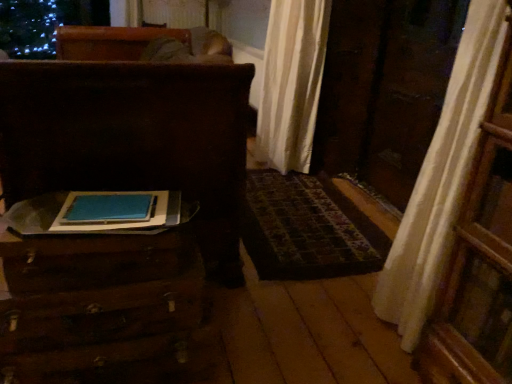
The image size is (512, 384). What do you see at coordinates (118, 235) in the screenshot? I see `wooden trunk at left, which is the second furniture in bottom-to-top order` at bounding box center [118, 235].

Where is `wooden trunk at left, which is the second furniture in bottom-to-top order`? The image size is (512, 384). wooden trunk at left, which is the second furniture in bottom-to-top order is located at coordinates (118, 235).

Where is `wooden suitcase at lower left, acting as the 1th furniture starting from the bottom`? Image resolution: width=512 pixels, height=384 pixels. wooden suitcase at lower left, acting as the 1th furniture starting from the bottom is located at coordinates (95, 301).

Describe the element at coordinates (95, 301) in the screenshot. The image size is (512, 384). I see `wooden suitcase at lower left, acting as the 1th furniture starting from the bottom` at that location.

At what (x,y) coordinates should I click in order to perform the action: click on wooden trunk at left, acting as the 1th furniture starting from the top. Please return your answer as a coordinate pair (x, y). The image size is (512, 384). Looking at the image, I should click on (118, 235).

Considering the positions of objects wooden suitcase at lower left, acting as the 1th furniture starting from the bottom, and wooden trunk at left, acting as the 1th furniture starting from the top, in the image provided, who is more to the right, wooden suitcase at lower left, acting as the 1th furniture starting from the bottom, or wooden trunk at left, acting as the 1th furniture starting from the top,?

From the viewer's perspective, wooden suitcase at lower left, acting as the 1th furniture starting from the bottom, appears more on the right side.

Which is in front, wooden suitcase at lower left, acting as the 1th furniture starting from the bottom, or wooden trunk at left, which is the second furniture in bottom-to-top order?

wooden suitcase at lower left, acting as the 1th furniture starting from the bottom, is more forward.

Between point (66, 353) and point (103, 251), which one is positioned in front?

Positioned in front is point (103, 251).

From the image's perspective, is wooden suitcase at lower left, which is the second furniture from top to bottom, on wooden trunk at left, acting as the 1th furniture starting from the top?

No, from the image's perspective, wooden suitcase at lower left, which is the second furniture from top to bottom, is not on top of wooden trunk at left, acting as the 1th furniture starting from the top.

From a real-world perspective, is wooden suitcase at lower left, acting as the 1th furniture starting from the bottom, positioned above or below wooden trunk at left, acting as the 1th furniture starting from the top?

Clearly, from a real-world perspective, wooden suitcase at lower left, acting as the 1th furniture starting from the bottom, is below wooden trunk at left, acting as the 1th furniture starting from the top.

Is wooden suitcase at lower left, which is the second furniture from top to bottom, wider than wooden trunk at left, which is the second furniture in bottom-to-top order?

No, wooden suitcase at lower left, which is the second furniture from top to bottom, is not wider than wooden trunk at left, which is the second furniture in bottom-to-top order.

In the scene shown: In terms of height, does wooden suitcase at lower left, acting as the 1th furniture starting from the bottom, look taller or shorter compared to wooden trunk at left, acting as the 1th furniture starting from the top?

Considering their sizes, wooden suitcase at lower left, acting as the 1th furniture starting from the bottom, has less height than wooden trunk at left, acting as the 1th furniture starting from the top.

Can you confirm if wooden suitcase at lower left, acting as the 1th furniture starting from the bottom, is smaller than wooden trunk at left, acting as the 1th furniture starting from the top?

Yes.

Is wooden suitcase at lower left, acting as the 1th furniture starting from the bottom, inside or outside of wooden trunk at left, which is the second furniture in bottom-to-top order?

wooden suitcase at lower left, acting as the 1th furniture starting from the bottom, is located beyond the bounds of wooden trunk at left, which is the second furniture in bottom-to-top order.

Can you see wooden suitcase at lower left, acting as the 1th furniture starting from the bottom, touching wooden trunk at left, acting as the 1th furniture starting from the top?

wooden suitcase at lower left, acting as the 1th furniture starting from the bottom, and wooden trunk at left, acting as the 1th furniture starting from the top, are clearly separated.

From the picture: Is wooden suitcase at lower left, which is the second furniture from top to bottom, positioned with its back to wooden trunk at left, acting as the 1th furniture starting from the top?

No.

How different are the orientations of wooden suitcase at lower left, which is the second furniture from top to bottom, and wooden trunk at left, acting as the 1th furniture starting from the top, in degrees?

5.11 degrees.

How far apart are wooden suitcase at lower left, which is the second furniture from top to bottom, and wooden trunk at left, acting as the 1th furniture starting from the top?

wooden suitcase at lower left, which is the second furniture from top to bottom, and wooden trunk at left, acting as the 1th furniture starting from the top, are 15.22 inches apart from each other.

I want to click on furniture that appears below the wooden trunk at left, which is the second furniture in bottom-to-top order (from a real-world perspective), so click(x=95, y=301).

Is wooden trunk at left, acting as the 1th furniture starting from the top, at the left side of wooden suitcase at lower left, which is the second furniture from top to bottom?

Indeed, wooden trunk at left, acting as the 1th furniture starting from the top, is positioned on the left side of wooden suitcase at lower left, which is the second furniture from top to bottom.

In the image, is wooden trunk at left, which is the second furniture in bottom-to-top order, positioned in front of or behind wooden suitcase at lower left, which is the second furniture from top to bottom?

In the image, wooden trunk at left, which is the second furniture in bottom-to-top order, appears behind wooden suitcase at lower left, which is the second furniture from top to bottom.

Considering the points (8, 80) and (61, 292), which point is in front, point (8, 80) or point (61, 292)?

The point (61, 292) is closer.

From the image's perspective, would you say wooden trunk at left, which is the second furniture in bottom-to-top order, is positioned over wooden suitcase at lower left, which is the second furniture from top to bottom?

Correct, wooden trunk at left, which is the second furniture in bottom-to-top order, appears higher than wooden suitcase at lower left, which is the second furniture from top to bottom, in the image.

From a real-world perspective, is wooden trunk at left, which is the second furniture in bottom-to-top order, located beneath wooden suitcase at lower left, acting as the 1th furniture starting from the bottom?

No, from a real-world perspective, wooden trunk at left, which is the second furniture in bottom-to-top order, is not under wooden suitcase at lower left, acting as the 1th furniture starting from the bottom.

Can you confirm if wooden trunk at left, acting as the 1th furniture starting from the top, is wider than wooden suitcase at lower left, which is the second furniture from top to bottom?

Correct, the width of wooden trunk at left, acting as the 1th furniture starting from the top, exceeds that of wooden suitcase at lower left, which is the second furniture from top to bottom.

Based on the photo, which of these two, wooden trunk at left, acting as the 1th furniture starting from the top, or wooden suitcase at lower left, acting as the 1th furniture starting from the bottom, stands shorter?

Standing shorter between the two is wooden suitcase at lower left, acting as the 1th furniture starting from the bottom.

Which of these two, wooden trunk at left, which is the second furniture in bottom-to-top order, or wooden suitcase at lower left, acting as the 1th furniture starting from the bottom, is smaller?

With smaller size is wooden suitcase at lower left, acting as the 1th furniture starting from the bottom.

Can we say wooden trunk at left, which is the second furniture in bottom-to-top order, lies outside wooden suitcase at lower left, which is the second furniture from top to bottom?

Yes.

Are wooden trunk at left, which is the second furniture in bottom-to-top order, and wooden suitcase at lower left, which is the second furniture from top to bottom, located far from each other?

They are positioned close to each other.

Is wooden trunk at left, acting as the 1th furniture starting from the top, facing towards wooden suitcase at lower left, which is the second furniture from top to bottom?

No, wooden trunk at left, acting as the 1th furniture starting from the top, is not aimed at wooden suitcase at lower left, which is the second furniture from top to bottom.

Image resolution: width=512 pixels, height=384 pixels. Find the location of `furniture on the right side of wooden trunk at left, acting as the 1th furniture starting from the top`. furniture on the right side of wooden trunk at left, acting as the 1th furniture starting from the top is located at coordinates (95, 301).

The width and height of the screenshot is (512, 384). Find the location of `furniture above the wooden suitcase at lower left, acting as the 1th furniture starting from the bottom (from the image's perspective)`. furniture above the wooden suitcase at lower left, acting as the 1th furniture starting from the bottom (from the image's perspective) is located at coordinates (118, 235).

Locate an element on the screen. The image size is (512, 384). furniture that appears below the wooden trunk at left, acting as the 1th furniture starting from the top (from a real-world perspective) is located at coordinates (95, 301).